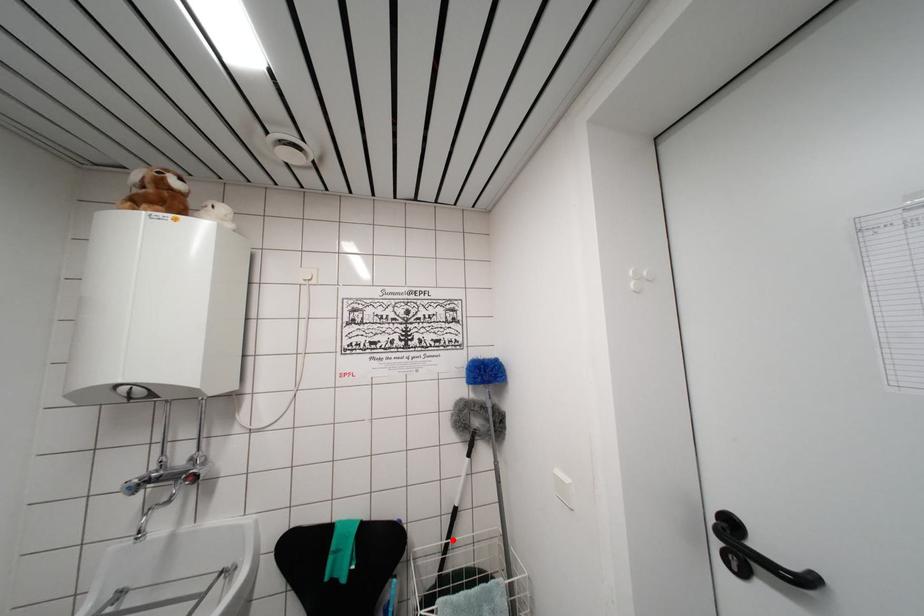
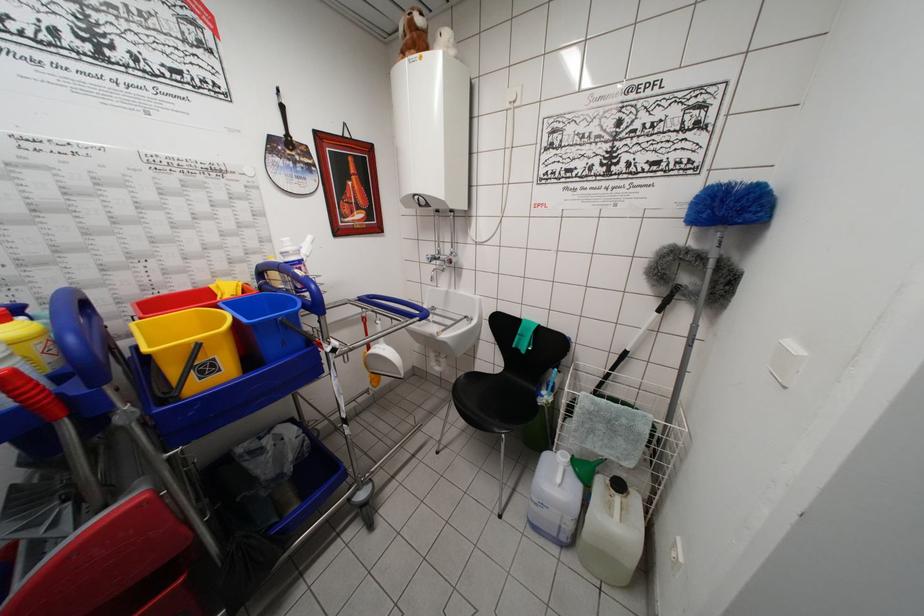
Question: A red point is marked in image1. In image2, is the corresponding 3D point closer to the camera or farther? Reply with the corresponding letter.

Choices:
 (A) The corresponding 3D point is closer.
 (B) The corresponding 3D point is farther.

Answer: (A)